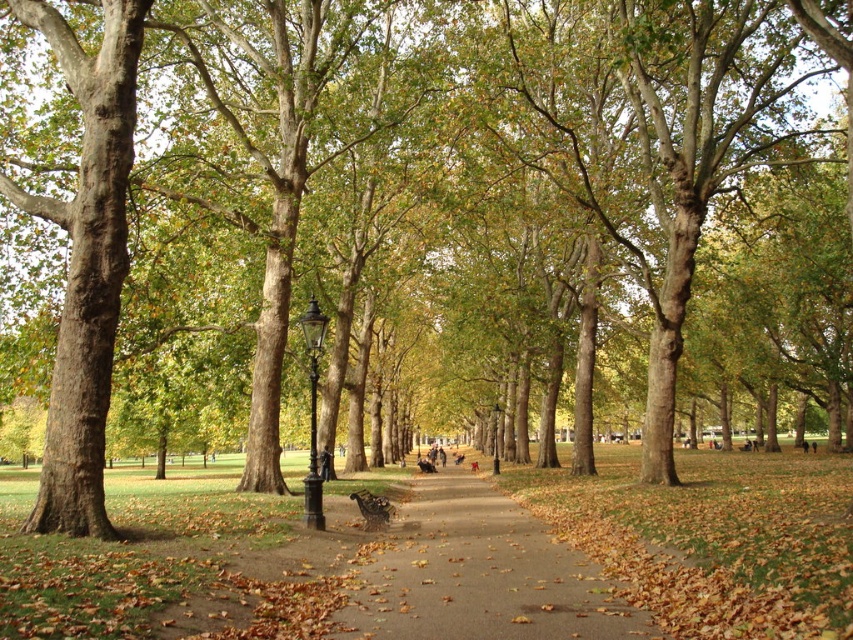
Does brown/rough pavement at center appear on the left side of wooden park bench at center?

In fact, brown/rough pavement at center is to the right of wooden park bench at center.

Find the location of a particular element. The image size is (853, 640). brown/rough pavement at center is located at coordinates (479, 573).

In order to click on brown/rough pavement at center in this screenshot , I will do pos(479,573).